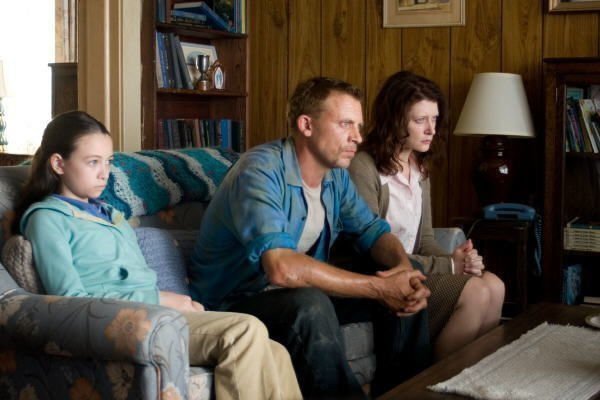
Locate an element on the screen. Image resolution: width=600 pixels, height=400 pixels. corded phone is located at coordinates (514, 208).